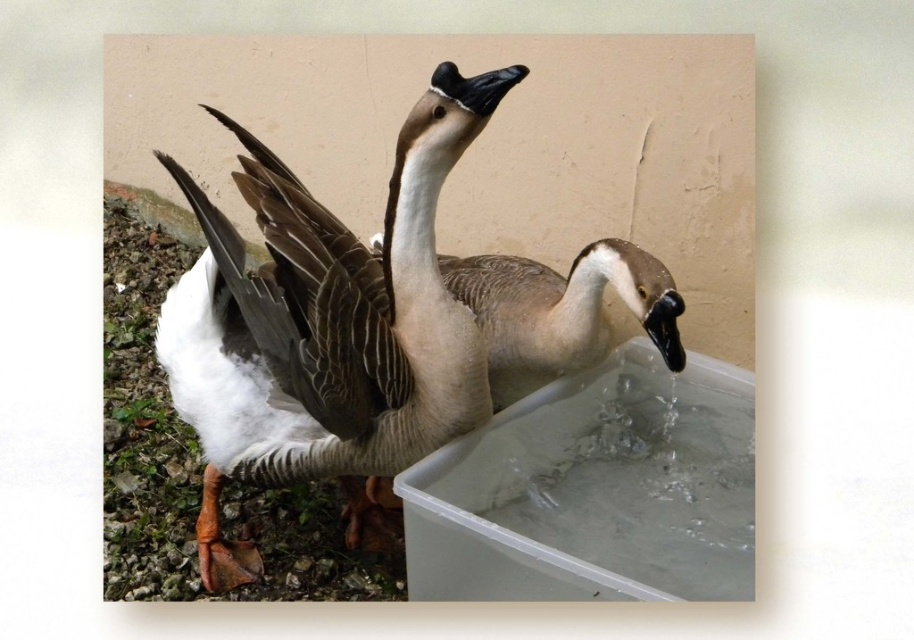
Question: Which point is farther to the camera?

Choices:
 (A) (231, 125)
 (B) (598, 307)

Answer: (B)

Question: Is white matte goose at center to the left of gray matte goose at center from the viewer's perspective?

Choices:
 (A) yes
 (B) no

Answer: (A)

Question: Which point is farther to the camera?

Choices:
 (A) (628, 276)
 (B) (199, 406)

Answer: (A)

Question: Is white matte goose at center to the right of gray matte goose at center from the viewer's perspective?

Choices:
 (A) yes
 (B) no

Answer: (B)

Question: Can you confirm if white matte goose at center is positioned to the right of gray matte goose at center?

Choices:
 (A) yes
 (B) no

Answer: (B)